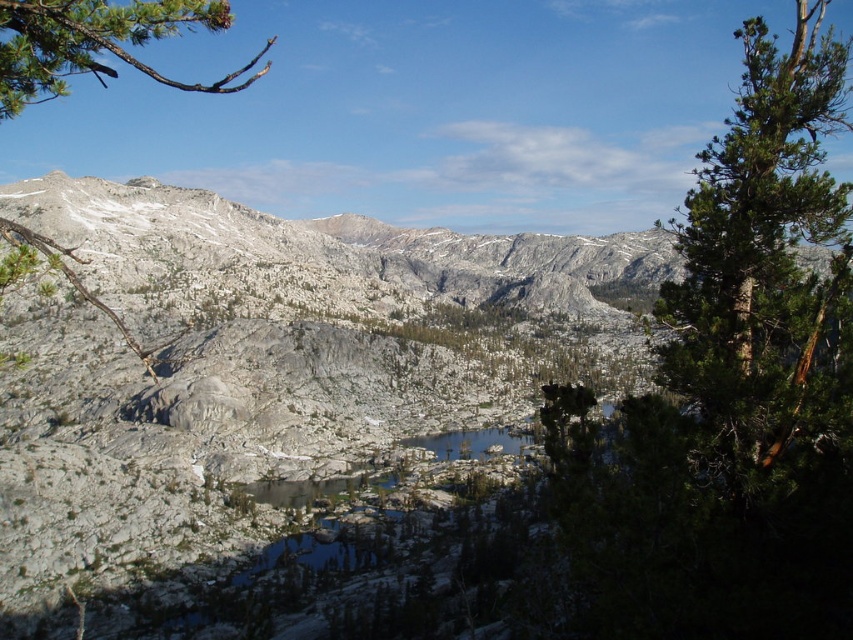
You are standing at the base of the mountain and want to reach the highest point in the image. Which point, point (601,544) or point (100,1), is closer to you and might be a better starting point for your climb?

Point (601,544) is closer to the viewer than point (100,1), so it might be a better starting point for your climb since it is nearer to your current position.

You are a hiker planning to take a photo of the gray rocky mountain at center and the green textured tree at right. Which object should you place on the left side of your photo to capture both in the frame?

The gray rocky mountain at center is positioned on the left side of green textured tree at right, so to capture both in the frame, you should place the gray rocky mountain at center on the left side of your photo.